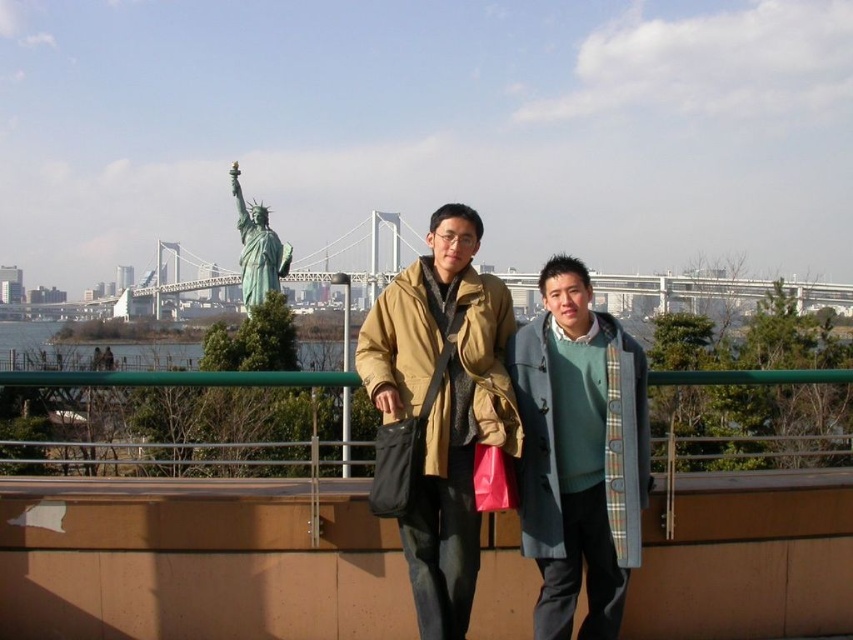
You are standing at the location of the point marked at coordinates (489, 424) in the image. The Statue of Liberty is visible in the background. If you want to get a closer view of the Statue of Liberty, should you walk towards or away from the point? Please explain your reasoning.

The point marked at coordinates (489, 424) is 146.62 feet away from the viewer. Since the Statue of Liberty is in the background of the image, it is farther away than the point. To get a closer view of the Statue of Liberty, you should walk away from the point towards the direction where the Statue of Liberty is located.

You are a photographer trying to capture the perfect shot of the gray wool coat at center. The camera is positioned at the point with coordinates point (579, 452). Where should you aim the camera to ensure the gray wool coat at center is in the frame?

The point (579, 452) indicates the location of the gray wool coat at center, so aiming the camera at that coordinate will ensure the gray wool coat at center is centered in the frame.

You are a photographer trying to capture a photo of the matte brown coat at center and the green patina statue at upper center in the background. If the statue is 73.61 meters away from the coat, how far apart are they in kilometers?

The matte brown coat at center is 73.61 meters from the green patina statue at upper center, so they are 0.07361 kilometers apart.